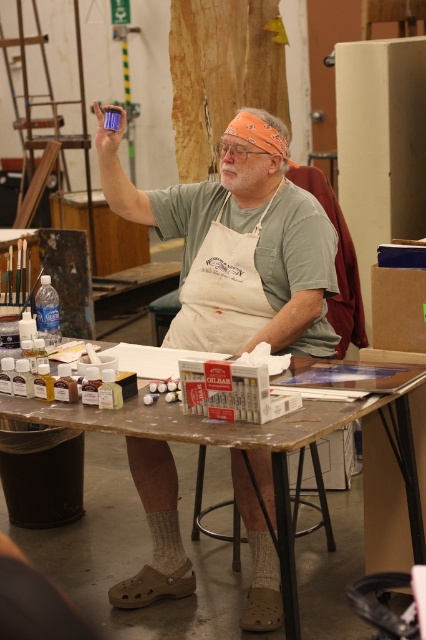
You are an assistant helping to organize the workshop. You need to place a large box on the workbench. Considering the matte green shirt at center and the wooden table at center, which object should you move to make space?

The matte green shirt at center should be moved because it occupies less space than the wooden table at center, making it easier to relocate to free up space for the large box.

You are a visitor in the workshop and want to place a 1.5 meter tall sculpture on the wooden table at center. Considering the height of the matte green shirt at center, will the sculpture block your view of the shirt?

The matte green shirt at center is much taller than the wooden table at center. Since the sculpture is 1.5 meters tall and placed on the table, it would likely block the view of the shirt if the shirt is positioned behind it, but since the shirt is taller than the table, it might still be visible depending on the exact placement.

You are a delivery robot with a height of 1.5 meters. You are entering the workshop and see the matte green shirt at center and the wooden table at center. Can you pass through the space between them without bending down?

The distance between the matte green shirt at center and the wooden table at center is 1.51 meters. Since the robot is 1.5 meters tall, it can pass through the space without bending down as the height clearance is sufficient.